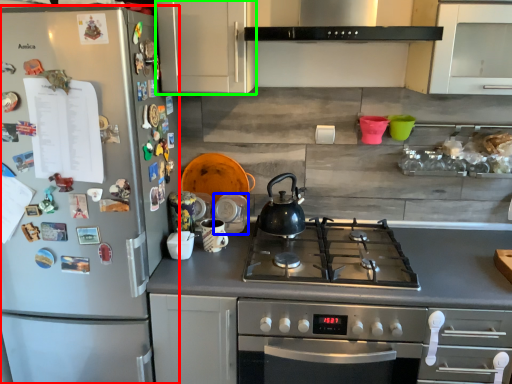
Question: Considering the real-world distances, which object is farthest from refrigerator (highlighted by a red box)? appliance (highlighted by a blue box) or cabinetry (highlighted by a green box)?

Choices:
 (A) appliance
 (B) cabinetry

Answer: (A)